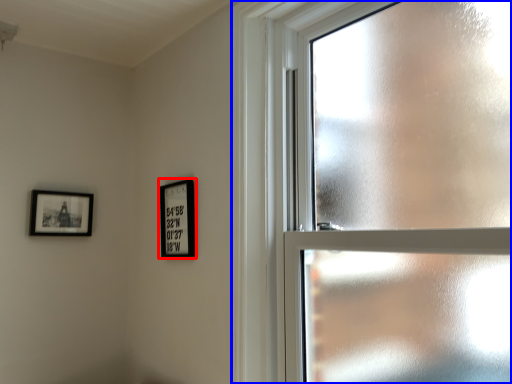
Question: Which point is closer to the camera, picture frame (highlighted by a red box) or window (highlighted by a blue box)?

Choices:
 (A) picture frame
 (B) window

Answer: (B)